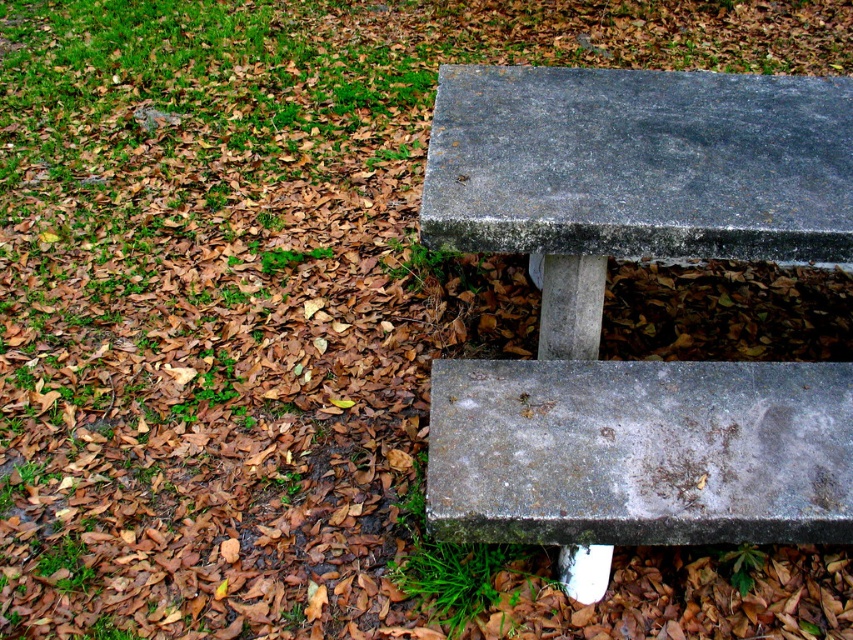
Question: Based on their relative distances, which object is farther from the gray concrete bench at lower right?

Choices:
 (A) gray concrete bench at upper center
 (B) gray concrete bench at center

Answer: (A)

Question: Which object is positioned farthest from the gray concrete bench at lower right?

Choices:
 (A) gray concrete bench at center
 (B) gray concrete bench at upper center

Answer: (B)

Question: Is the position of gray concrete bench at center more distant than that of gray concrete bench at upper center?

Choices:
 (A) yes
 (B) no

Answer: (B)

Question: Is gray concrete bench at center to the right of gray concrete bench at lower right from the viewer's perspective?

Choices:
 (A) yes
 (B) no

Answer: (B)

Question: Among these points, which one is nearest to the camera?

Choices:
 (A) [552, 141]
 (B) [766, 536]

Answer: (B)

Question: Does gray concrete bench at center have a larger size compared to gray concrete bench at lower right?

Choices:
 (A) yes
 (B) no

Answer: (A)